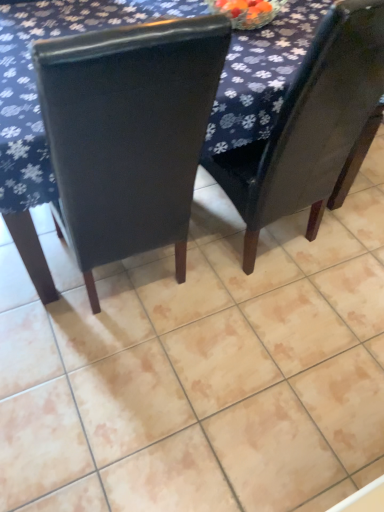
Question: From the image's perspective, is matte black chair at center, acting as the 1th chair starting from the right, located above or below dark blue fabric at upper center?

Choices:
 (A) above
 (B) below

Answer: (B)

Question: Based on their sizes in the image, would you say matte black chair at center, acting as the 1th chair starting from the right, is bigger or smaller than dark blue fabric at upper center?

Choices:
 (A) big
 (B) small

Answer: (B)

Question: Which of these objects is positioned farthest from the dark blue fabric at upper center?

Choices:
 (A) matte black chair at center, acting as the 1th chair starting from the right
 (B) matte black chair at center, acting as the 2th chair starting from the right

Answer: (A)

Question: Based on their relative distances, which object is nearer to the matte black chair at center, acting as the 2th chair starting from the right?

Choices:
 (A) matte black chair at center, which ranks as the second chair in left-to-right order
 (B) dark blue fabric at upper center

Answer: (B)